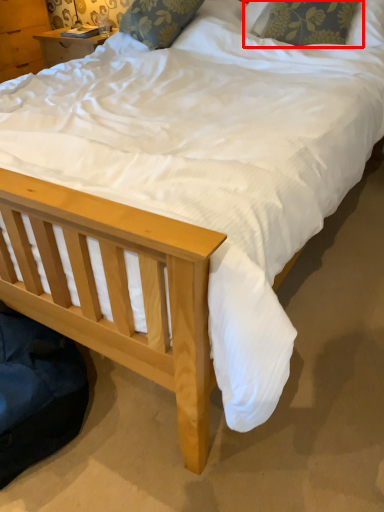
Question: From the image's perspective, considering the relative positions of pillow (annotated by the red box) and pillow in the image provided, where is pillow (annotated by the red box) located with respect to the staircase?

Choices:
 (A) above
 (B) below

Answer: (B)